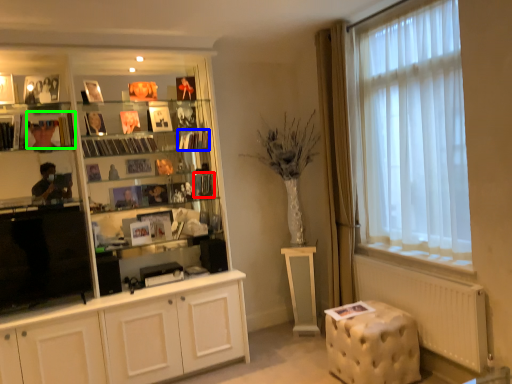
Question: Which object is the farthest from book (highlighted by a red box)? Choose among these: book (highlighted by a blue box) or book (highlighted by a green box).

Choices:
 (A) book
 (B) book

Answer: (B)